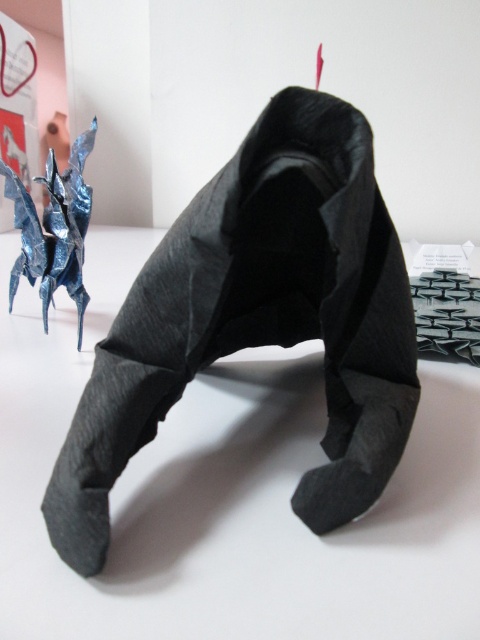
What are the exact coordinates of the black paper sculpture at center?

The black paper sculpture at center is located at point (259, 317).

Consider the image. You are an art curator planning to display the black paper sculpture at center and the metallic blue origami dragon at upper left in a narrow exhibition space. Given that the space can only accommodate items up to 1 meter in width, which of the two artworks would you need to adjust the placement of to ensure they both fit within the width constraint?

The black paper sculpture at center has a larger width than the metallic blue origami dragon at upper left. Since the space can only accommodate items up to 1 meter in width, if the sculpture exceeds this width, it would need to be adjusted. However, if both are under 1 meter, no adjustment is needed. The question doesn not provide exact measurements, so the curator should check the sculpture first due to its larger size.

You are an art curator planning to display the black paper sculpture at center and the metallic blue origami dragon at upper left in a new exhibition. The museum requires that all displayed items must be at least 15 inches apart for safety. Can you confirm if the current spacing between them meets the museum requirements?

The black paper sculpture at center is 17.41 inches away from the metallic blue origami dragon at upper left, which exceeds the required 15 inches, so the spacing meets the museum requirements.